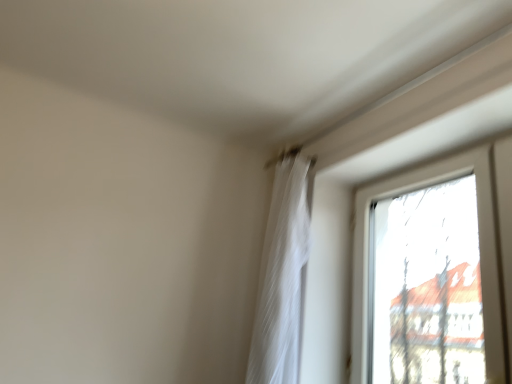
Question: From the image's perspective, is white sheer curtain at upper center located beneath transparent glass window at upper right?

Choices:
 (A) yes
 (B) no

Answer: (B)

Question: Considering the relative sizes of white sheer curtain at upper center and transparent glass window at upper right in the image provided, is white sheer curtain at upper center smaller than transparent glass window at upper right?

Choices:
 (A) no
 (B) yes

Answer: (B)

Question: Is white sheer curtain at upper center oriented towards transparent glass window at upper right?

Choices:
 (A) no
 (B) yes

Answer: (A)

Question: Does white sheer curtain at upper center have a larger size compared to transparent glass window at upper right?

Choices:
 (A) yes
 (B) no

Answer: (B)

Question: Can you confirm if white sheer curtain at upper center is thinner than transparent glass window at upper right?

Choices:
 (A) no
 (B) yes

Answer: (A)

Question: Is white sheer curtain at upper center taller than transparent glass window at upper right?

Choices:
 (A) no
 (B) yes

Answer: (B)

Question: Does transparent glass window at upper right appear on the left side of white sheer curtain at upper center?

Choices:
 (A) yes
 (B) no

Answer: (B)

Question: From the image's perspective, is transparent glass window at upper right beneath white sheer curtain at upper center?

Choices:
 (A) no
 (B) yes

Answer: (B)

Question: Is transparent glass window at upper right outside of white sheer curtain at upper center?

Choices:
 (A) yes
 (B) no

Answer: (A)

Question: Does transparent glass window at upper right appear on the right side of white sheer curtain at upper center?

Choices:
 (A) yes
 (B) no

Answer: (A)

Question: Is the position of transparent glass window at upper right less distant than that of white sheer curtain at upper center?

Choices:
 (A) yes
 (B) no

Answer: (A)

Question: Is the depth of transparent glass window at upper right greater than that of white sheer curtain at upper center?

Choices:
 (A) no
 (B) yes

Answer: (A)

Question: Do you think white sheer curtain at upper center is within transparent glass window at upper right, or outside of it?

Choices:
 (A) inside
 (B) outside

Answer: (B)